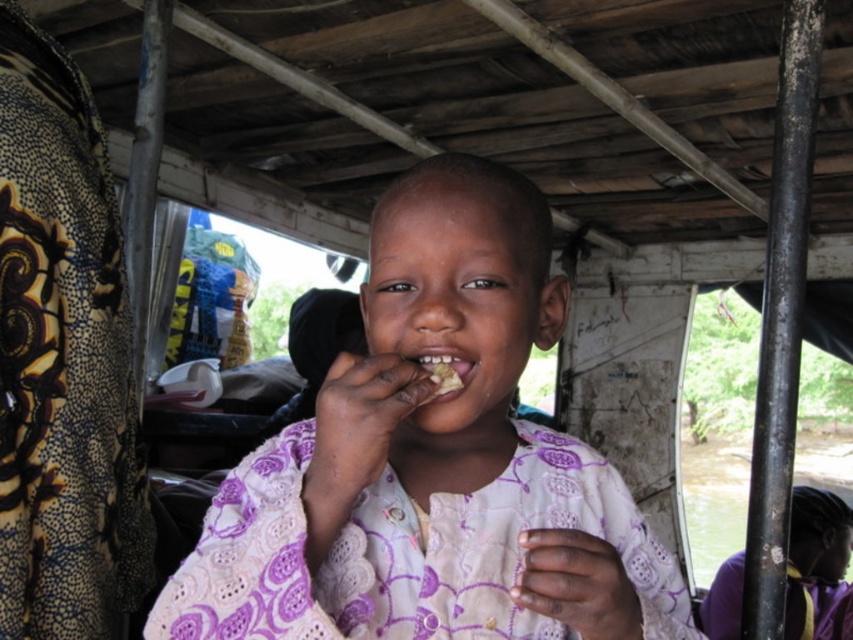
From the picture: Which is below, purple lace shirt at center or purple fabric at lower right?

Positioned lower is purple fabric at lower right.

Can you confirm if purple lace shirt at center is shorter than purple fabric at lower right?

Yes, purple lace shirt at center is shorter than purple fabric at lower right.

At what (x,y) coordinates should I click in order to perform the action: click on purple lace shirt at center. Please return your answer as a coordinate pair (x, y). Looking at the image, I should click on (431, 461).

Is point (837, 509) closer to viewer compared to point (430, 380)?

That is False.

At what (x,y) coordinates should I click in order to perform the action: click on purple fabric at lower right. Please return your answer as a coordinate pair (x, y). Looking at the image, I should click on click(815, 557).

The width and height of the screenshot is (853, 640). What are the coordinates of `purple fabric at lower right` in the screenshot? It's located at [815, 557].

Image resolution: width=853 pixels, height=640 pixels. Identify the location of purple fabric at lower right. pos(815,557).

Looking at this image, is yellowish matte food at center thinner than white crumbly food at mouth?

In fact, yellowish matte food at center might be wider than white crumbly food at mouth.

Does yellowish matte food at center have a lesser height compared to white crumbly food at mouth?

Incorrect, yellowish matte food at center's height does not fall short of white crumbly food at mouth's.

The height and width of the screenshot is (640, 853). Identify the location of yellowish matte food at center. (439, 372).